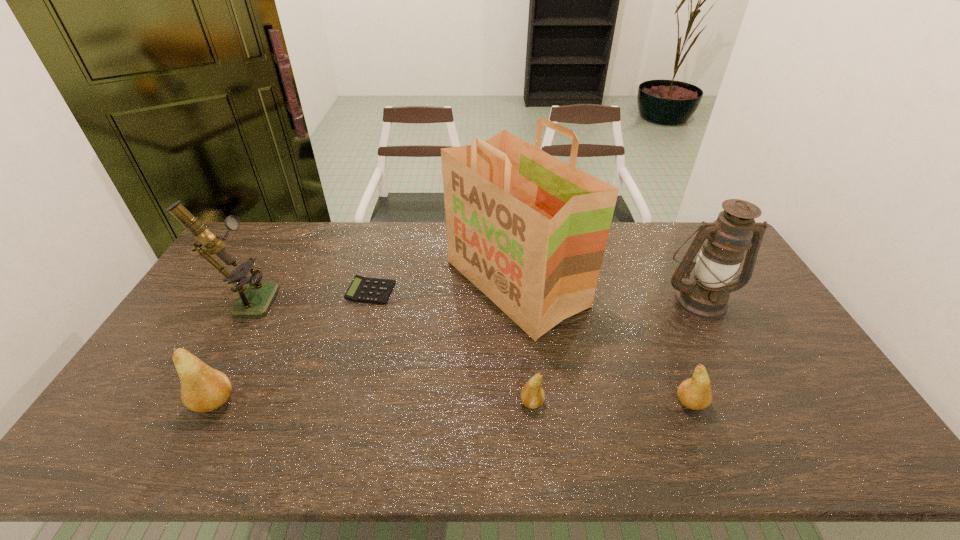
The width and height of the screenshot is (960, 540). Identify the location of the rightmost object. (705, 295).

The width and height of the screenshot is (960, 540). In order to click on free space located on the right of the fourth tallest object in this screenshot , I will do `click(362, 402)`.

Find the location of a particular element. free space located on the right of the shortest pear is located at coordinates 682,402.

Locate an element on the screen. blank space located 0.240m on the right of the sixth object from left to right is located at coordinates (801, 403).

This screenshot has height=540, width=960. In order to click on blank space located 0.240m on the right of the fifth object from right to left in this screenshot , I will do `click(468, 292)`.

What are the coordinates of `free spot located 0.120m on the right of the grocery bag` in the screenshot? It's located at (622, 283).

At what (x,y) coordinates should I click in order to perform the action: click on vacant point located 0.070m at the eyepiece of the microscope. Please return your answer as a coordinate pair (x, y). This screenshot has height=540, width=960. Looking at the image, I should click on (298, 298).

Where is `vacant position located on the left of the rightmost object`? The width and height of the screenshot is (960, 540). vacant position located on the left of the rightmost object is located at coordinates (628, 300).

I want to click on object positioned at the far edge, so pos(528,230).

Locate an element on the screen. This screenshot has width=960, height=540. object present at the left edge is located at coordinates (255, 299).